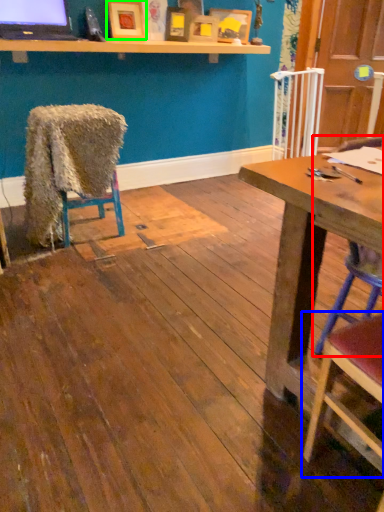
Question: Based on their relative distances, which object is nearer to chair (highlighted by a red box)? Choose from chair (highlighted by a blue box) and picture frame (highlighted by a green box).

Choices:
 (A) chair
 (B) picture frame

Answer: (A)